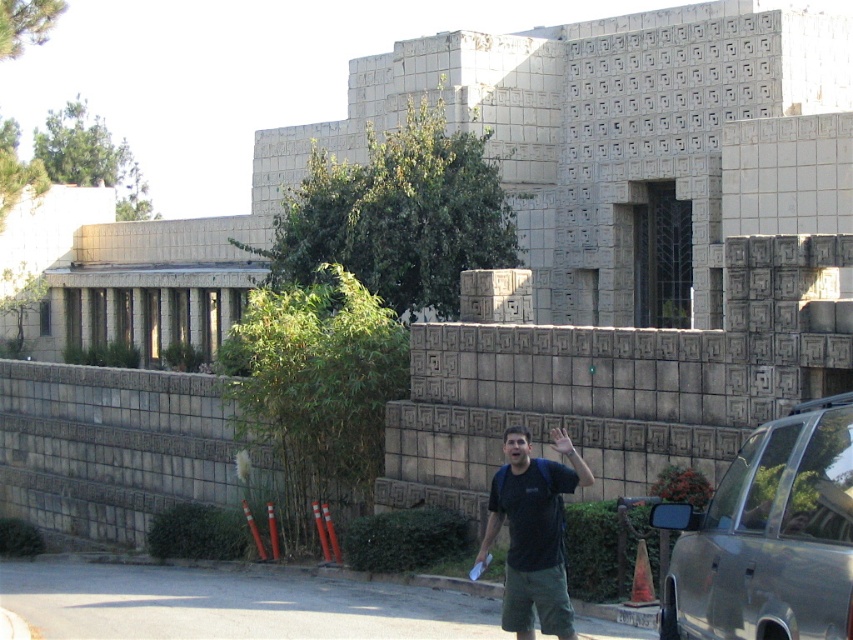
You are an artist observing the modernist building and its surroundings. You notice the black fabric shirt at center and the matte black hand at center. Which object is wider when viewed from your perspective?

The black fabric shirt at center is wider than the matte black hand at center.

Looking at this image, you are standing at the entrance of the modernist building and want to park your silver metallic car at lower right. What are the coordinates where you should position it?

The silver metallic car at lower right should be positioned at coordinates point (x=769, y=536).

Based on the photo, you are standing in front of a modernist building with a geometric design. There is a point marked at coordinates point (784,509). If you want to place a 3 meter long bench between yourself and this point, will there be enough space?

The distance between you and point (784,509) is 6.56 meters. Since the bench is 3 meters long, there is sufficient space to place it between you and the point.